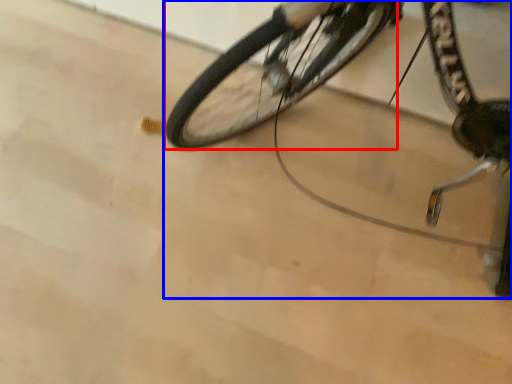
Question: Which point is closer to the camera, bicycle wheel (highlighted by a red box) or bicycle (highlighted by a blue box)?

Choices:
 (A) bicycle wheel
 (B) bicycle

Answer: (B)